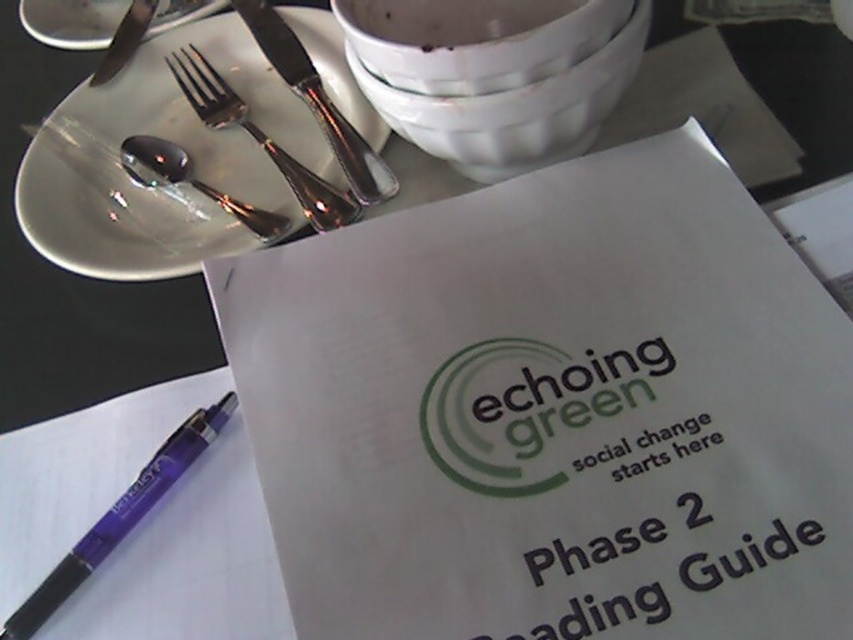
You are looking at the table setting and want to place a new item between the two points labeled as point (257, 164) and point (119, 12). Based on their positions, which point should the new item be closer to if it needs to be nearer to the viewer?

The new item should be placed closer to point (257, 164) because it is closer to the viewer than point (119, 12).

You are setting the table for a formal dinner and need to place the satin silver knife at upper left and shiny silver spoon at upper left. According to proper etiquette, which item should be placed closer to the plate?

The satin silver knife at upper left should be placed closer to the plate because it has a lesser width compared to the shiny silver spoon at upper left, and etiquette typically places smaller utensils nearest to the plate.